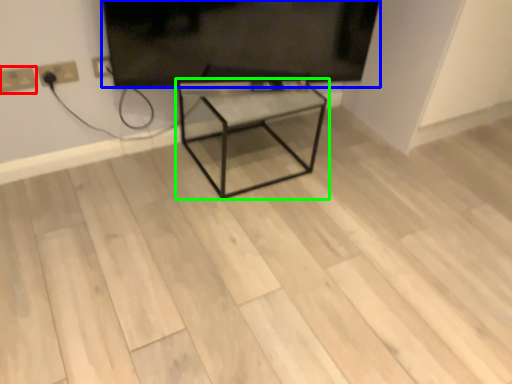
Question: Estimate the real-world distances between objects in this image. Which object is farther from electric outlet (highlighted by a red box), television (highlighted by a blue box) or table (highlighted by a green box)?

Choices:
 (A) television
 (B) table

Answer: (B)